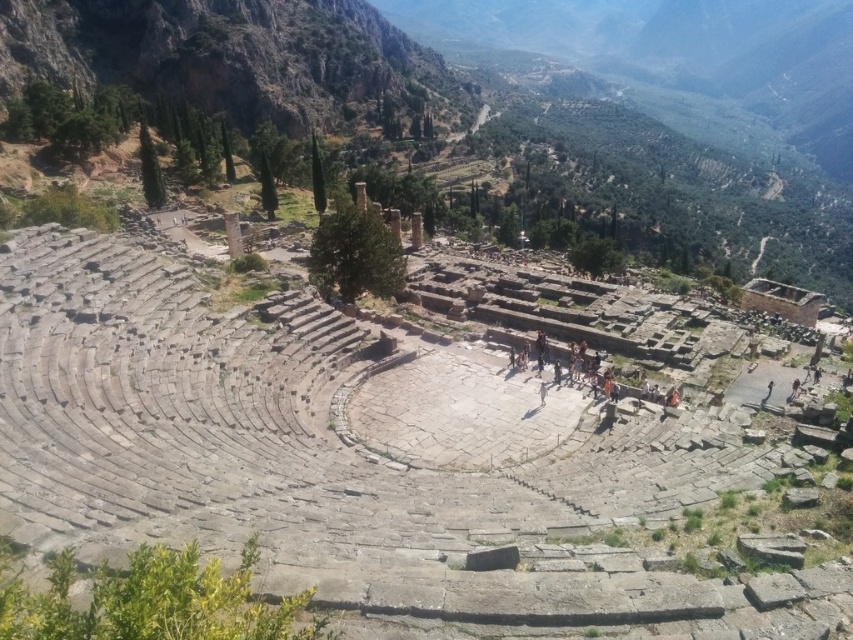
You are standing at the entrance of the amphitheater and notice the rugged stone mountain at upper left and the orange fabric people at center. Which object is located to the left of the other?

The rugged stone mountain at upper left is positioned on the left side of orange fabric people at center.

You are standing at the entrance of the amphitheater and see two points marked in the scene. The first point is at coordinate point (368, 3) and the second is at point (622, 352). Which point is closer to you?

Point (368, 3) is closer to you because it is further to the camera than point (622, 352).